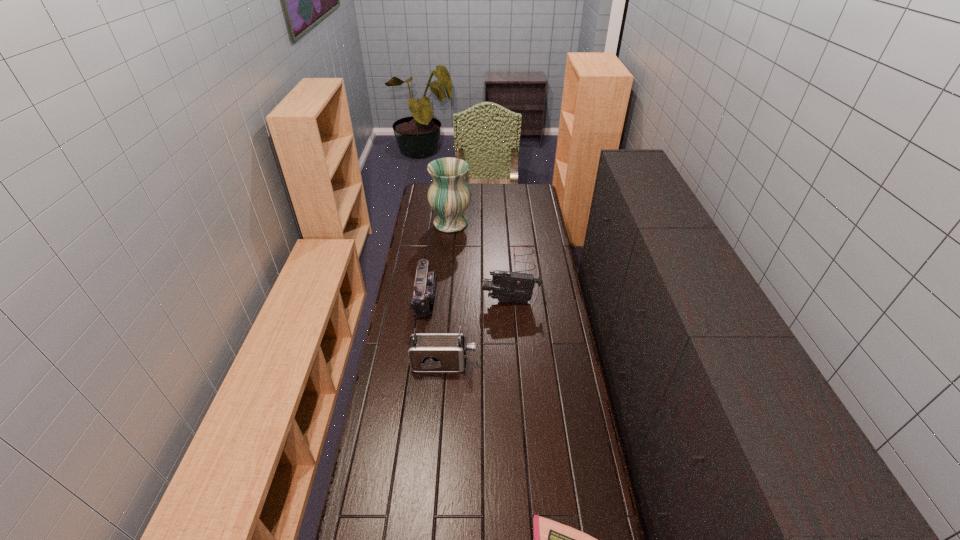
Locate an element on the screen. vacant space at the left edge of the desktop is located at coordinates (407, 422).

Find the location of `vacant space at the right edge`. vacant space at the right edge is located at coordinates (572, 440).

At what (x,y) coordinates should I click in order to perform the action: click on free space at the far right corner. Please return your answer as a coordinate pair (x, y). The image size is (960, 540). Looking at the image, I should click on (526, 202).

Where is `unoccupied area between the spectacles and the fourth tallest object`? unoccupied area between the spectacles and the fourth tallest object is located at coordinates (475, 278).

Locate an element on the screen. The width and height of the screenshot is (960, 540). vacant area that lies between the second nearest object and the rightmost camcorder is located at coordinates (476, 333).

Identify which object is located as the fifth nearest to the farthest object. Please provide its 2D coordinates. Your answer should be formatted as a tuple, i.e. [(x, y)], where the tuple contains the x and y coordinates of a point satisfying the conditions above.

[(552, 539)]

Locate an element on the screen. the third closest object to the fourth tallest object is located at coordinates (449, 196).

At what (x,y) coordinates should I click in order to perform the action: click on the third closest camcorder relative to the shortest object. Please return your answer as a coordinate pair (x, y). This screenshot has height=540, width=960. Looking at the image, I should click on (506, 286).

Where is `camcorder object that ranks as the third closest to the spectacles`? This screenshot has height=540, width=960. camcorder object that ranks as the third closest to the spectacles is located at coordinates (428, 352).